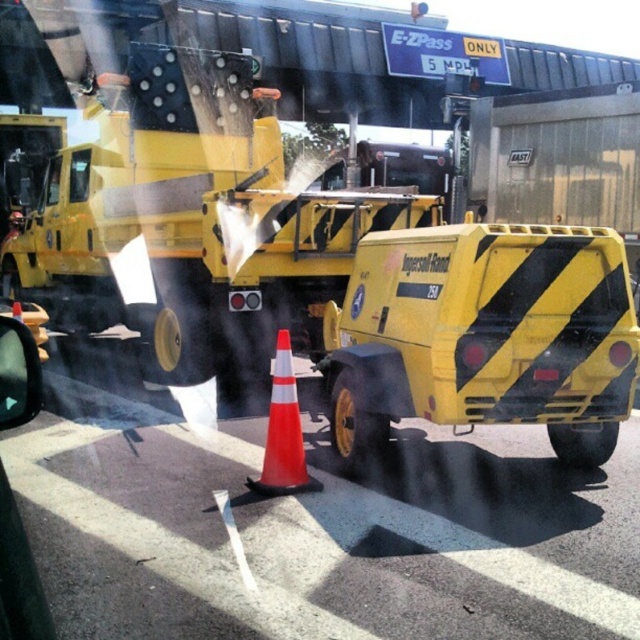
Question: From the image, what is the correct spatial relationship of yellow matte asphalt roller at center in relation to orange reflective cone at center?

Choices:
 (A) below
 (B) above

Answer: (B)

Question: Which object appears closest to the camera in this image?

Choices:
 (A) orange reflective cone at center
 (B) yellow matte asphalt roller at center

Answer: (B)

Question: Does yellow matte asphalt roller at center appear over orange reflective cone at center?

Choices:
 (A) yes
 (B) no

Answer: (A)

Question: Can you confirm if yellow matte asphalt roller at center is positioned to the left of orange reflective cone at center?

Choices:
 (A) no
 (B) yes

Answer: (A)

Question: Which point is farther to the camera?

Choices:
 (A) (394, 300)
 (B) (276, 465)

Answer: (A)

Question: Which point is closer to the camera taking this photo?

Choices:
 (A) (269, 477)
 (B) (444, 362)

Answer: (B)